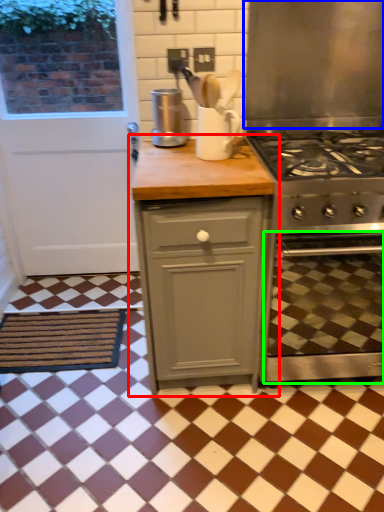
Question: Which object is positioned closest to cabinetry (highlighted by a red box)? Select from exhaust hood (highlighted by a blue box) and oven (highlighted by a green box).

Choices:
 (A) exhaust hood
 (B) oven

Answer: (B)